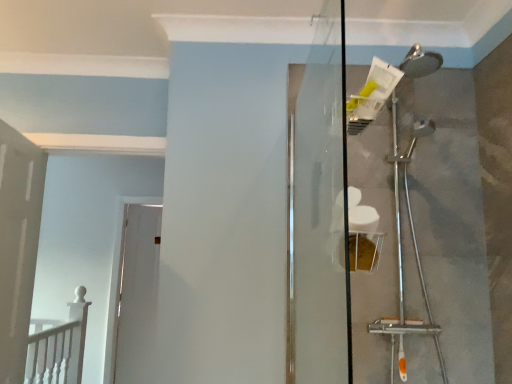
Question: Which direction should I rotate to face white glossy door at center, which is the second door from front to back, — up or down?

Choices:
 (A) down
 (B) up

Answer: (A)

Question: Considering the relative sizes of transparent glass screen door at center and white painted wood door at left, which is counted as the 2th door, starting from the back, in the image provided, is transparent glass screen door at center smaller than white painted wood door at left, which is counted as the 2th door, starting from the back,?

Choices:
 (A) yes
 (B) no

Answer: (A)

Question: Can we say transparent glass screen door at center lies outside white painted wood door at left, which is counted as the 2th door, starting from the back?

Choices:
 (A) no
 (B) yes

Answer: (B)

Question: Is transparent glass screen door at center thinner than white painted wood door at left, which is the first door in front-to-back order?

Choices:
 (A) yes
 (B) no

Answer: (A)

Question: Is transparent glass screen door at center positioned in front of white painted wood door at left, which is the first door in front-to-back order?

Choices:
 (A) yes
 (B) no

Answer: (A)

Question: Can you confirm if transparent glass screen door at center is shorter than white painted wood door at left, which is counted as the 2th door, starting from the back?

Choices:
 (A) no
 (B) yes

Answer: (B)

Question: From a real-world perspective, is transparent glass screen door at center under white painted wood door at left, which is the first door in front-to-back order?

Choices:
 (A) no
 (B) yes

Answer: (A)

Question: Are white wooden railing at lower left and white painted wood door at left, which is the first door in front-to-back order, located far from each other?

Choices:
 (A) yes
 (B) no

Answer: (B)

Question: From the image's perspective, does white wooden railing at lower left appear higher than white painted wood door at left, which is the first door in front-to-back order?

Choices:
 (A) no
 (B) yes

Answer: (A)

Question: Is white wooden railing at lower left taller than white painted wood door at left, which is counted as the 2th door, starting from the back?

Choices:
 (A) no
 (B) yes

Answer: (A)

Question: Does white wooden railing at lower left turn towards white painted wood door at left, which is counted as the 2th door, starting from the back?

Choices:
 (A) no
 (B) yes

Answer: (A)

Question: Is white wooden railing at lower left not within white painted wood door at left, which is counted as the 2th door, starting from the back?

Choices:
 (A) no
 (B) yes

Answer: (B)

Question: Is white wooden railing at lower left further to the viewer compared to white painted wood door at left, which is counted as the 2th door, starting from the back?

Choices:
 (A) no
 (B) yes

Answer: (B)

Question: Are transparent glass screen door at center and white glossy door at center, which is the second door from front to back, located far from each other?

Choices:
 (A) yes
 (B) no

Answer: (A)